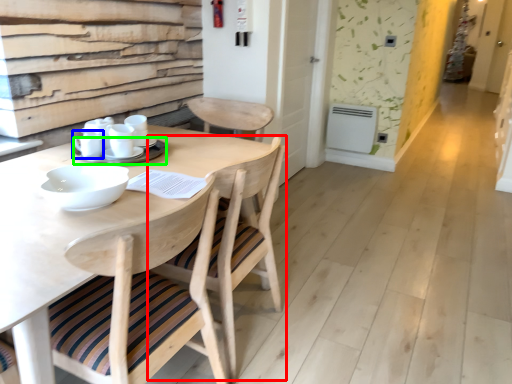
Question: Based on their relative distances, which object is nearer to chair (highlighted by a red box)? Choose from tableware (highlighted by a blue box) and tableware (highlighted by a green box).

Choices:
 (A) tableware
 (B) tableware

Answer: (B)